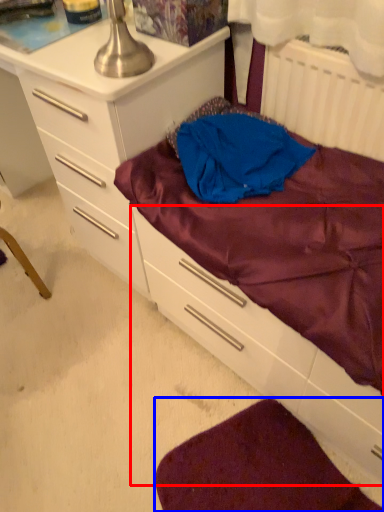
Question: Among these objects, which one is nearest to the camera, drawer (highlighted by a red box) or sheet (highlighted by a blue box)?

Choices:
 (A) drawer
 (B) sheet

Answer: (A)